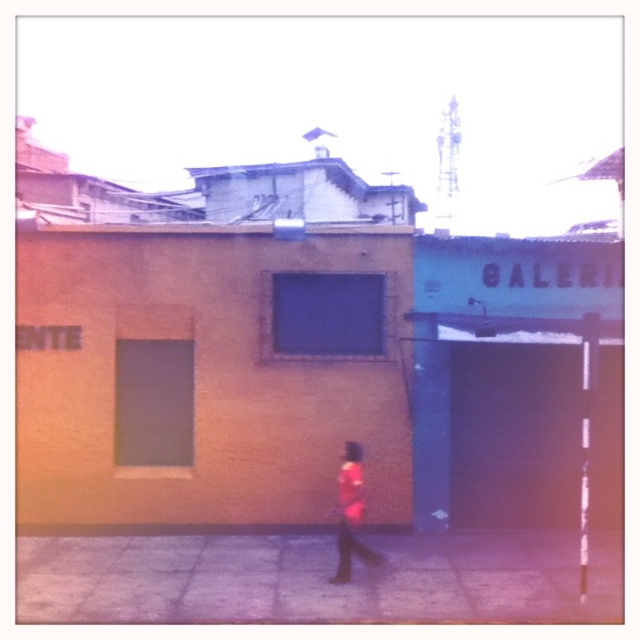
Which of these two, gray concrete pavement at lower center or pink fabric dress at center, stands shorter?

gray concrete pavement at lower center

Is gray concrete pavement at lower center further to camera compared to pink fabric dress at center?

No, it is not.

What do you see at coordinates (314, 577) in the screenshot? I see `gray concrete pavement at lower center` at bounding box center [314, 577].

This screenshot has width=640, height=640. What are the coordinates of `gray concrete pavement at lower center` in the screenshot? It's located at (314, 577).

Can you confirm if matte orange wall at center is taller than gray concrete pavement at lower center?

Yes.

Between point (19, 284) and point (417, 577), which one is positioned behind?

The point (19, 284) is more distant.

Where is `matte orange wall at center`? matte orange wall at center is located at coordinates (202, 376).

Does matte orange wall at center have a lesser width compared to pink fabric dress at center?

No.

Is matte orange wall at center wider than pink fabric dress at center?

Yes, matte orange wall at center is wider than pink fabric dress at center.

Which is in front, point (276, 246) or point (346, 540)?

Point (346, 540)

I want to click on matte orange wall at center, so click(x=202, y=376).